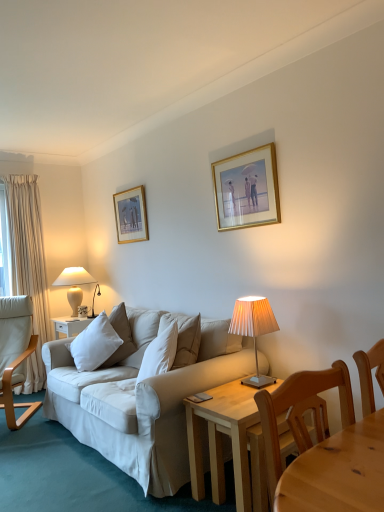
The height and width of the screenshot is (512, 384). In order to click on vacant space to the left of pleated beige lampshade at center, arranged as the second lamp when viewed from the back in this screenshot , I will do pos(230,388).